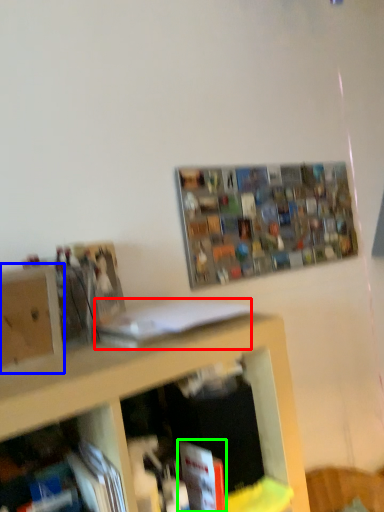
Question: Which is farther away from book (highlighted by a red box)? cabinet (highlighted by a blue box) or book (highlighted by a green box)?

Choices:
 (A) cabinet
 (B) book

Answer: (B)